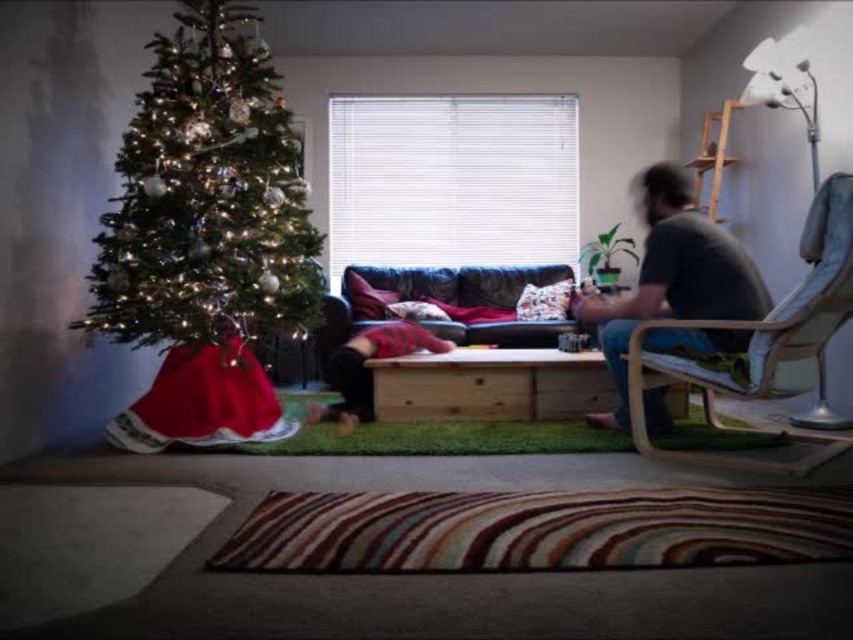
You are sitting on the leather couch at center and want to hang a decoration on the green matte christmas tree at left. Can you reach the tree from your current position without moving?

The green matte christmas tree at left is above the leather couch at center, so you can reach it from your current position without needing to move.

You are sitting in the light brown wood armchair at right and want to reach the gray matte shirt at right. Based on the scene description, can you easily reach the shirt from your current position?

The light brown wood armchair at right is located below the gray matte shirt at right, so you can easily reach the shirt from the armchair.